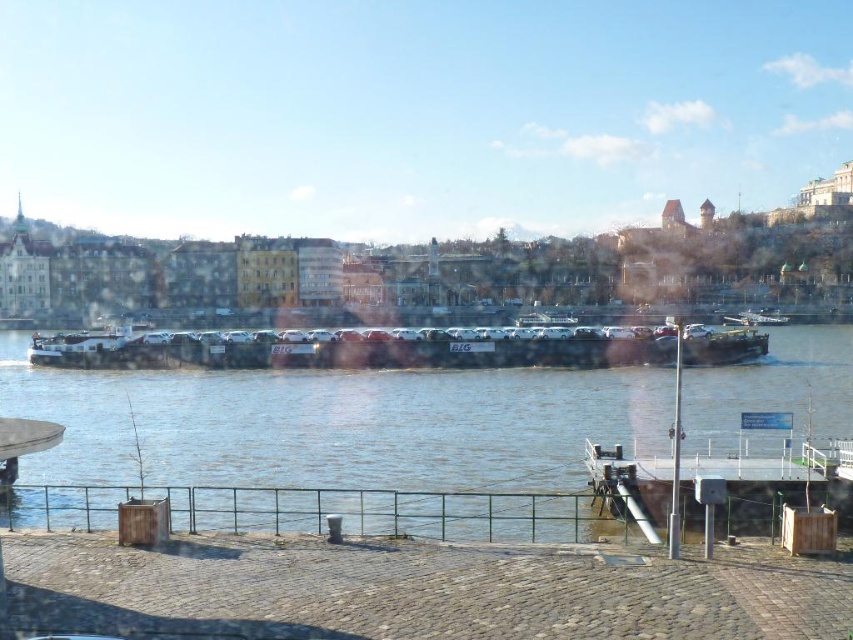
Question: Does brown matte water at center appear on the right side of metallic gray barge at center?

Choices:
 (A) yes
 (B) no

Answer: (B)

Question: Is the position of brown matte water at center less distant than that of metallic gray barge at center?

Choices:
 (A) yes
 (B) no

Answer: (A)

Question: Which point is farther to the camera?

Choices:
 (A) brown matte water at center
 (B) metallic gray barge at center

Answer: (B)

Question: Does brown matte water at center appear on the right side of metallic gray barge at center?

Choices:
 (A) yes
 (B) no

Answer: (B)

Question: Among these points, which one is nearest to the camera?

Choices:
 (A) (287, 413)
 (B) (576, 353)

Answer: (A)